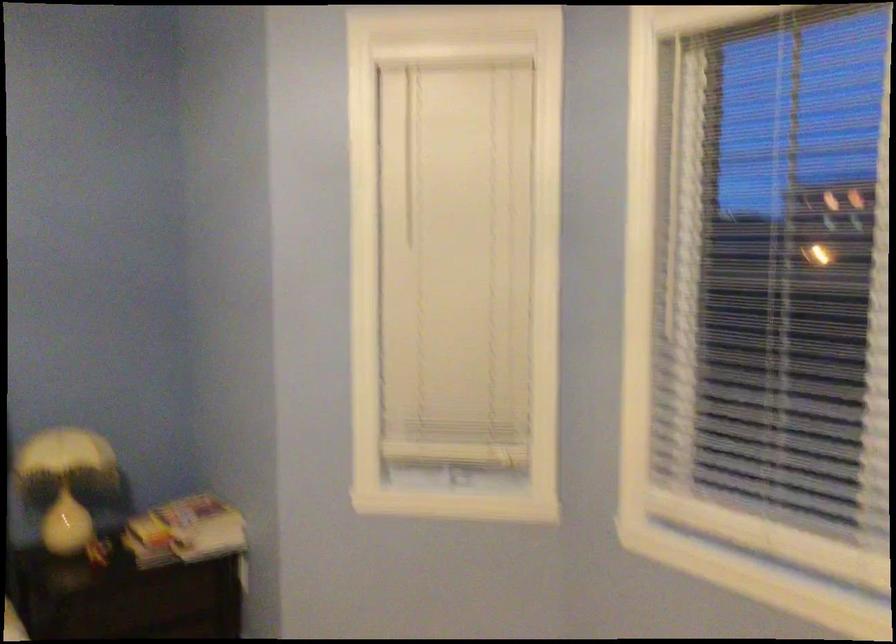
This screenshot has width=896, height=644. In order to click on blind bottom handle in this screenshot , I will do `click(462, 471)`.